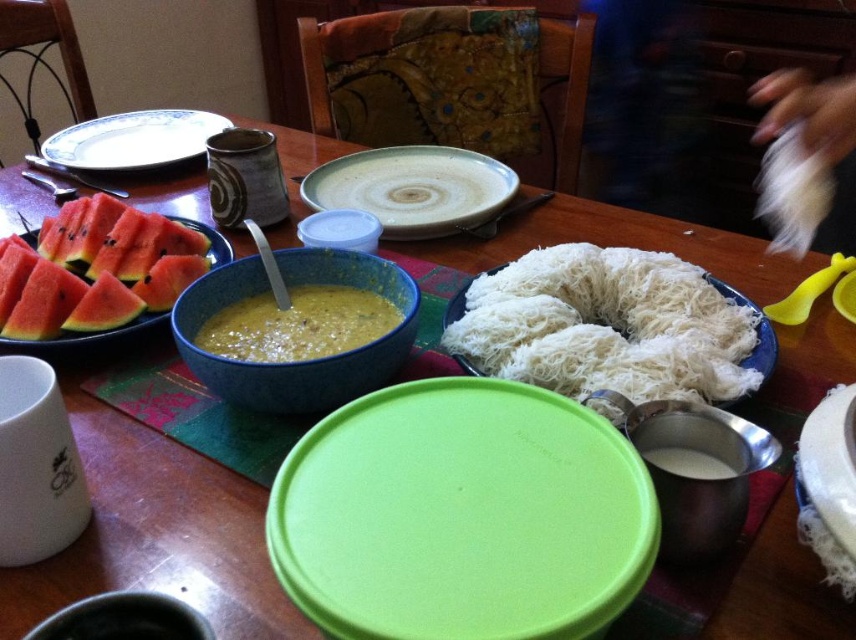
Question: Observing the image, what is the correct spatial positioning of white ceramic plate at upper left in reference to white matte plate at lower right?

Choices:
 (A) left
 (B) right

Answer: (A)

Question: Can you confirm if yellow creamy soup at center is positioned above white ceramic plate at upper left?

Choices:
 (A) yes
 (B) no

Answer: (B)

Question: Does white ceramic plate at upper left have a lesser width compared to matte black bowl at lower left?

Choices:
 (A) yes
 (B) no

Answer: (B)

Question: Which is nearer to the red matte watermelon slices at left?

Choices:
 (A) white matte plate at lower right
 (B) speckled ceramic plate at center

Answer: (B)

Question: Which object is the closest to the matte black bowl at lower left?

Choices:
 (A) speckled ceramic plate at center
 (B) red matte watermelon slices at left
 (C) white shredded food at center
 (D) green plastic lid at center

Answer: (D)

Question: Which object appears farthest from the camera in this image?

Choices:
 (A) matte black bowl at lower left
 (B) white shredded food at center
 (C) speckled ceramic plate at center
 (D) white matte plate at lower right

Answer: (C)